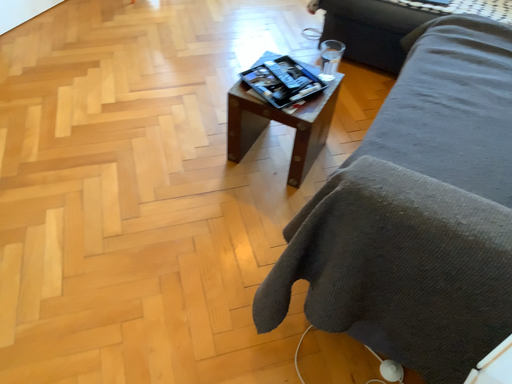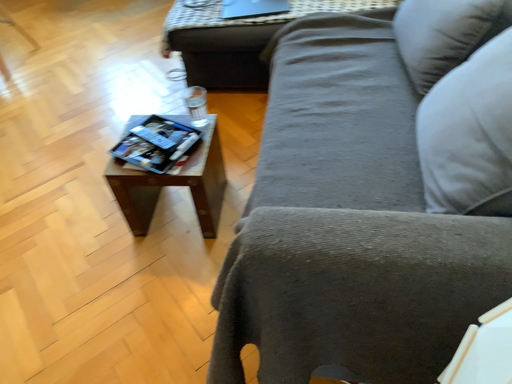
Question: How did the camera likely rotate when shooting the video?

Choices:
 (A) rotated left
 (B) rotated right

Answer: (B)